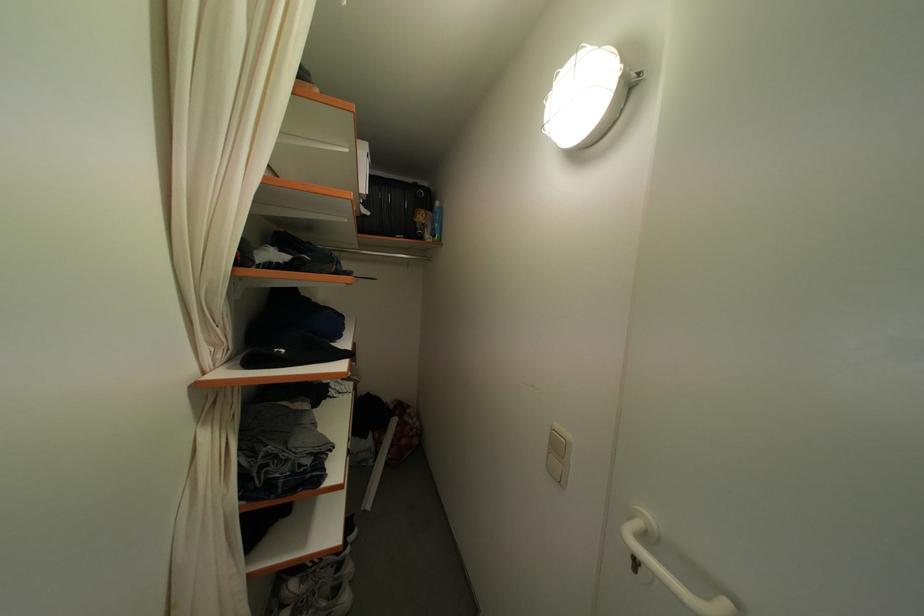
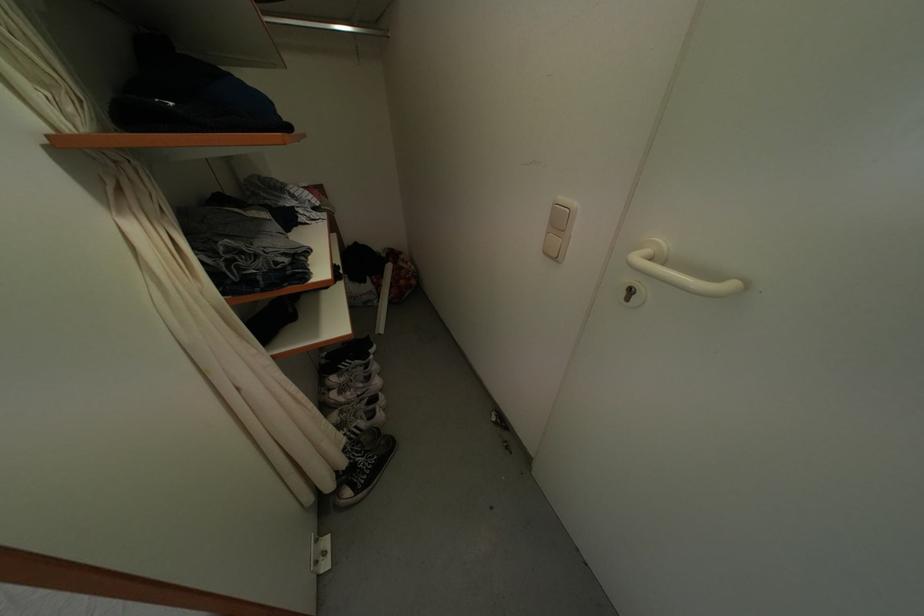
In the second image, find the point that corresponds to pixel 564 453 in the first image.

(565, 228)